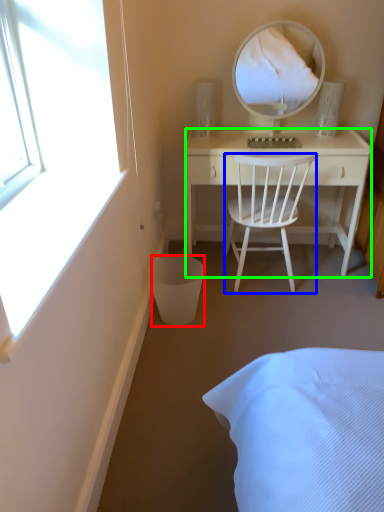
Question: Which object is positioned farthest from trash bin/can (highlighted by a red box)? Select from chair (highlighted by a blue box) and desk (highlighted by a green box).

Choices:
 (A) chair
 (B) desk

Answer: (B)